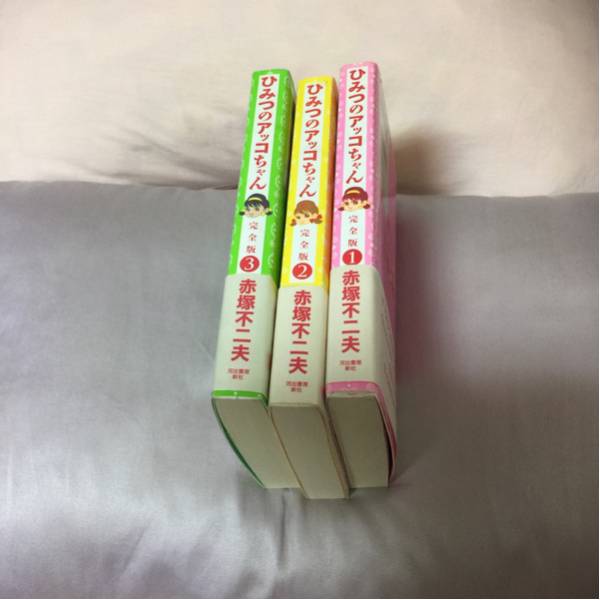
Identify the location of yellow white and red book spine. The image size is (600, 600). (320, 264).